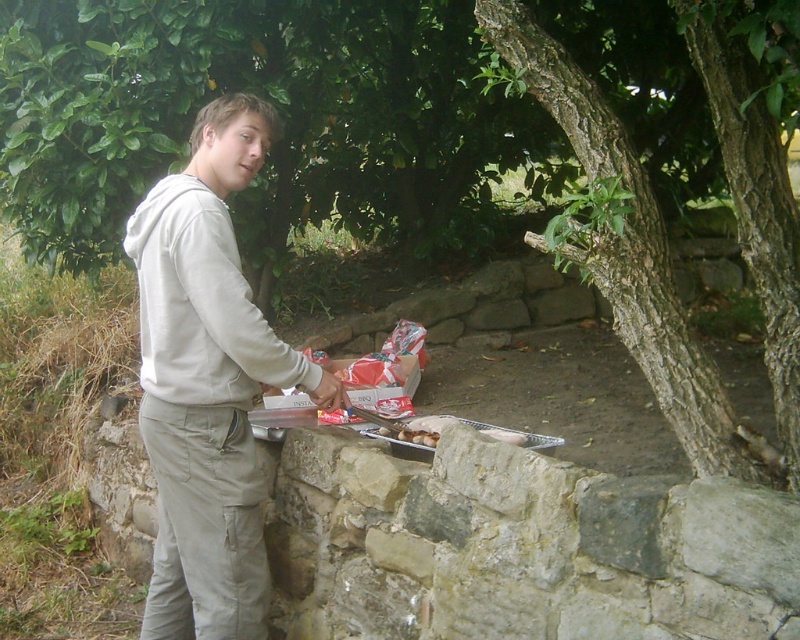
You are standing at the point with coordinates (208, 381) in the image. What object are you currently standing on?

The point (208, 381) is on the light gray hoodie at center.

You are a photographer trying to capture a closeup of the white fleece sweatshirt at center and the brown rough bark tree at center. Which object should you zoom in on first if you want to focus on the wider subject?

The brown rough bark tree at center is wider than the white fleece sweatshirt at center, so you should zoom in on the brown rough bark tree at center first to focus on the wider subject.